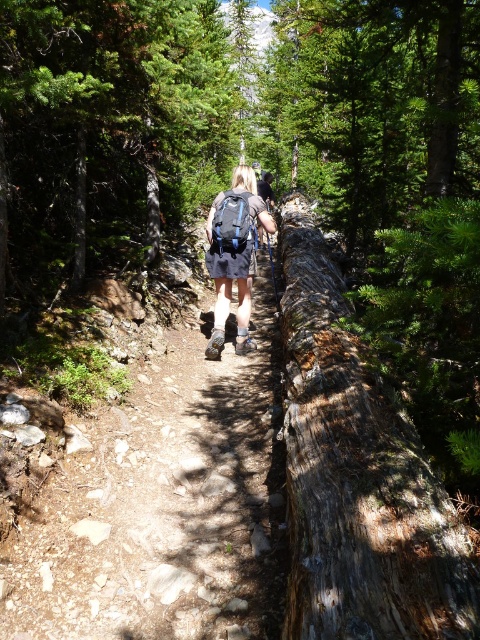
In the scene shown: You are a hiker carrying a matte black backpack at center. You need to walk along the brown dirt trail at center. Based on the scene, can your backpack fit through the trail without getting stuck?

The brown dirt trail at center is wider than the matte black backpack at center, so the backpack will fit through the trail without getting stuck.

You are a hiker carrying a heavy load and need to navigate the narrow trail. You see the matte black backpack at center and the matte blue backpack at center. Which backpack is closer to the ground?

The matte black backpack at center is positioned under the matte blue backpack at center, so it is closer to the ground.

You are a hiker carrying a matte blue backpack at center and need to continue along the brown dirt trail at center. Based on the scene, can you step onto the trail without moving the backpack?

The brown dirt trail at center is located below matte blue backpack at center, so yes, you can step onto the trail below the backpack without needing to move it.